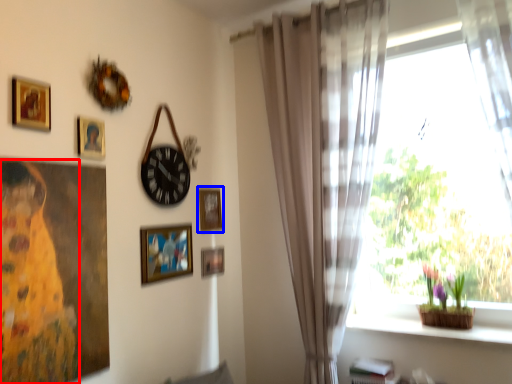
Question: Which object is closer to the camera taking this photo, woman (highlighted by a red box) or picture frame (highlighted by a blue box)?

Choices:
 (A) woman
 (B) picture frame

Answer: (A)